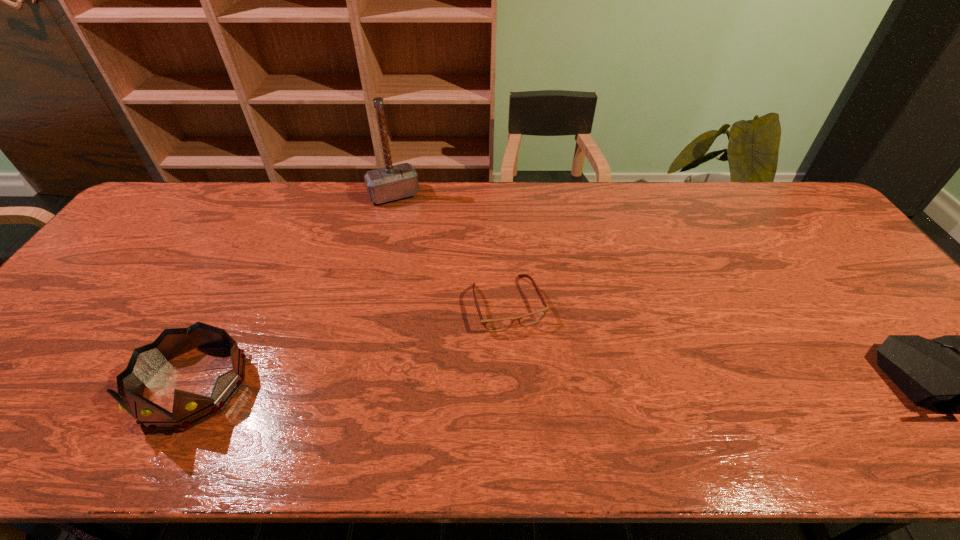
The image size is (960, 540). What are the coordinates of `the leftmost object` in the screenshot? It's located at tap(189, 410).

You are a GUI agent. You are given a task and a screenshot of the screen. Output one action in this format:
    pyautogui.click(x=<x>, y=<y>)
    Task: Click on the tiara
    
    Given the screenshot: What is the action you would take?
    pyautogui.click(x=189, y=410)

Where is `the third object from right to left`? the third object from right to left is located at coordinates (390, 183).

Image resolution: width=960 pixels, height=540 pixels. I want to click on hammer, so click(x=390, y=183).

Where is `the third nearest object`? Image resolution: width=960 pixels, height=540 pixels. the third nearest object is located at coordinates (492, 325).

The image size is (960, 540). I want to click on spectacles, so click(x=492, y=325).

The width and height of the screenshot is (960, 540). In order to click on free spot located on the striking surface of the farthest object in this screenshot , I will do `click(435, 274)`.

Where is `free location located on the striking surface of the farthest object`? This screenshot has width=960, height=540. free location located on the striking surface of the farthest object is located at coordinates (438, 281).

This screenshot has width=960, height=540. What are the coordinates of `vacant space located 0.120m on the striking surface of the farthest object` in the screenshot? It's located at (412, 228).

Find the location of a particular element. vacant region located on the front-facing side of the third nearest object is located at coordinates (537, 378).